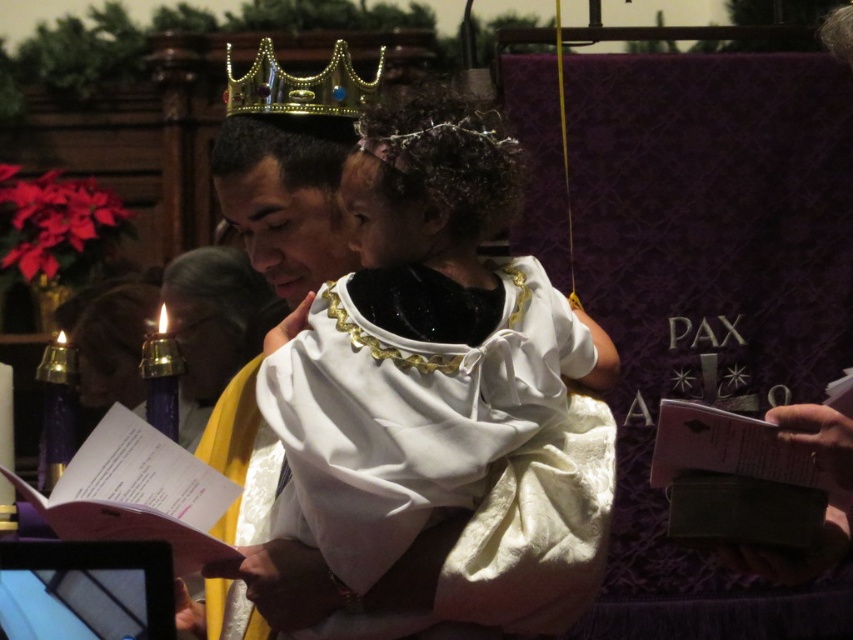
Is point (344, 444) closer to viewer compared to point (316, 108)?

Yes, it is.

In order to click on white satin dress at center in this screenshot , I will do `click(418, 340)`.

Is point (363, 412) farther from viewer compared to point (274, 74)?

No, (363, 412) is in front of (274, 74).

Where is `white satin dress at center`? The width and height of the screenshot is (853, 640). white satin dress at center is located at coordinates (418, 340).